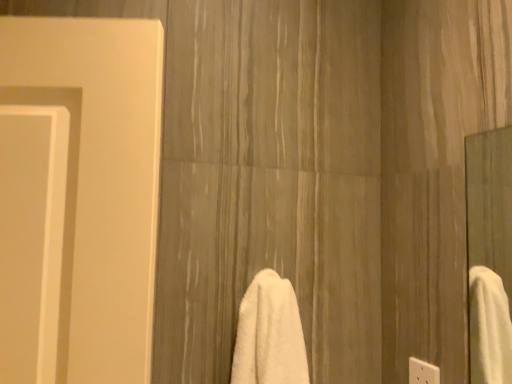
Question: Are white fluffy towel at center and white plastic electric outlet at lower right far apart?

Choices:
 (A) yes
 (B) no

Answer: (B)

Question: Is white fluffy towel at center smaller than white plastic electric outlet at lower right?

Choices:
 (A) yes
 (B) no

Answer: (B)

Question: Does white fluffy towel at center lie behind white plastic electric outlet at lower right?

Choices:
 (A) yes
 (B) no

Answer: (B)

Question: Is white fluffy towel at center thinner than white plastic electric outlet at lower right?

Choices:
 (A) no
 (B) yes

Answer: (A)

Question: Is white fluffy towel at center beside white plastic electric outlet at lower right?

Choices:
 (A) no
 (B) yes

Answer: (A)

Question: Can you confirm if white fluffy towel at center is shorter than white plastic electric outlet at lower right?

Choices:
 (A) yes
 (B) no

Answer: (B)

Question: Is white plastic electric outlet at lower right facing away from white fluffy towel at center?

Choices:
 (A) yes
 (B) no

Answer: (B)

Question: Is white plastic electric outlet at lower right behind white fluffy towel at center?

Choices:
 (A) yes
 (B) no

Answer: (A)

Question: Can white fluffy towel at center be found inside white plastic electric outlet at lower right?

Choices:
 (A) no
 (B) yes

Answer: (A)

Question: Can you confirm if white plastic electric outlet at lower right is thinner than white fluffy towel at center?

Choices:
 (A) no
 (B) yes

Answer: (B)

Question: Considering the relative positions of white plastic electric outlet at lower right and white fluffy towel at center in the image provided, is white plastic electric outlet at lower right to the right of white fluffy towel at center from the viewer's perspective?

Choices:
 (A) yes
 (B) no

Answer: (A)

Question: From a real-world perspective, is white plastic electric outlet at lower right located higher than white fluffy towel at center?

Choices:
 (A) no
 (B) yes

Answer: (A)

Question: In the image, is white plastic electric outlet at lower right positioned in front of or behind white fluffy towel at center?

Choices:
 (A) behind
 (B) front

Answer: (A)